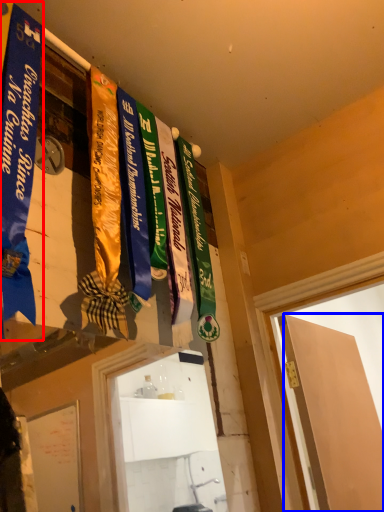
Question: Among these objects, which one is farthest to the camera, banner (highlighted by a red box) or door (highlighted by a blue box)?

Choices:
 (A) banner
 (B) door

Answer: (B)